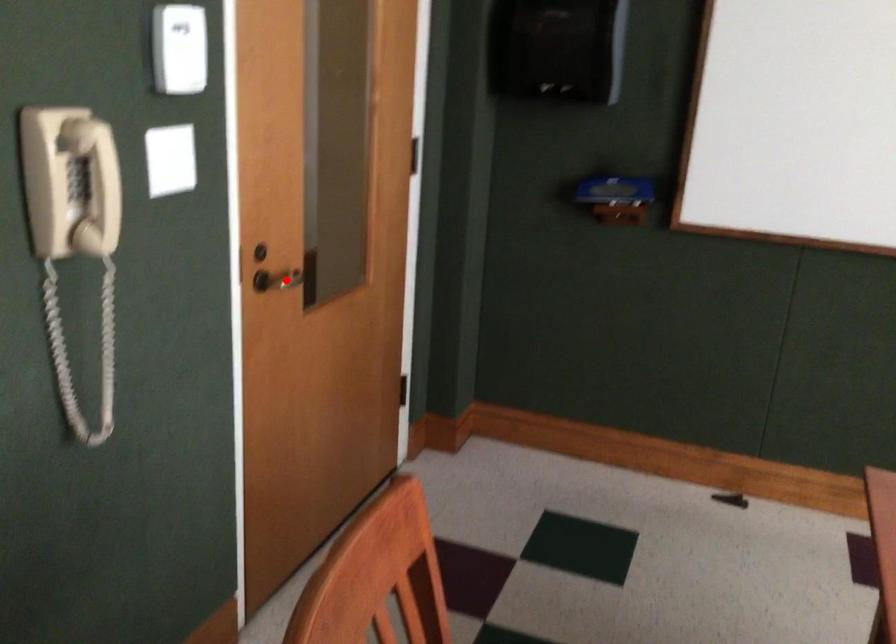
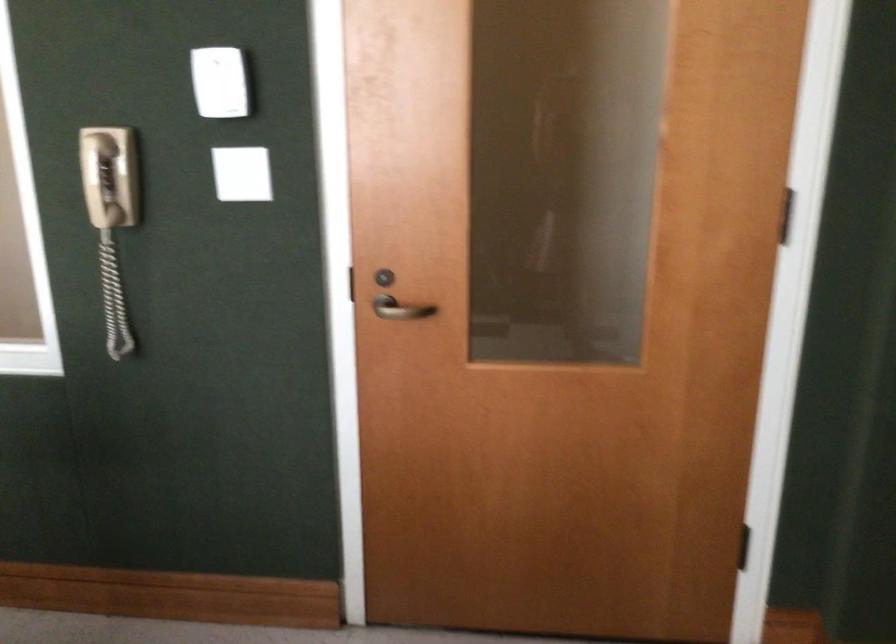
Find the pixel in the second image that matches the highlighted location in the first image.

(401, 308)